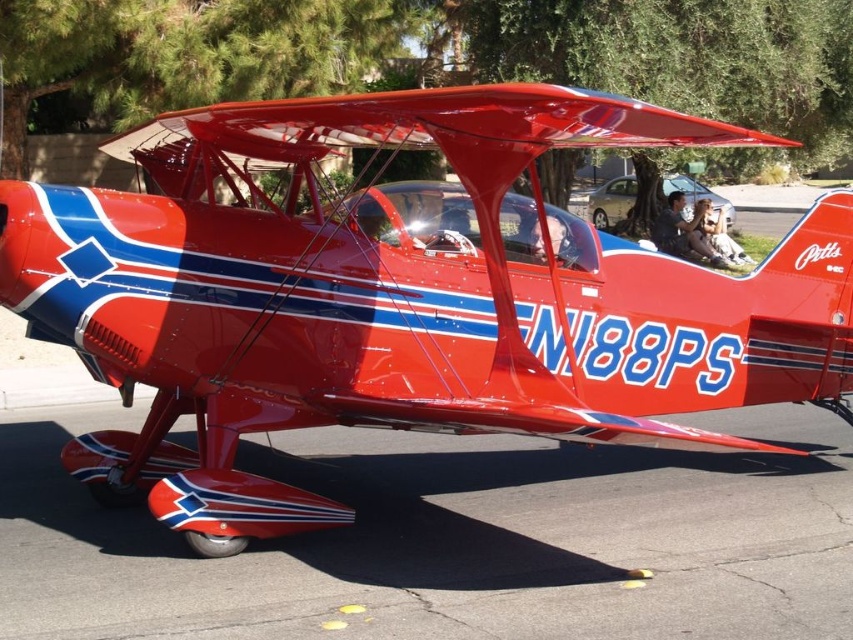
You are standing at the point with coordinates point (399, 296). Based on the scene, what object are you currently standing on?

The point (399, 296) corresponds to the glossy red airplane at center, so you are standing on the glossy red airplane at center.

You are a pilot planning to taxi the glossy red airplane at center from its current position. Based on its location coordinates, can you determine if it is centered on the paved surface?

The glossy red airplane at center is located at point coordinates, so it is centered on the paved surface.